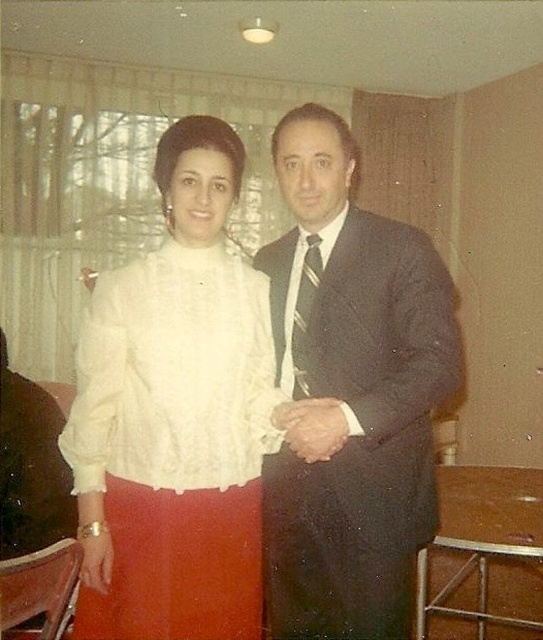
You are a photographer adjusting the lighting for a portrait. You notice the white lace blouse at center and the striped silk tie at center. Which item requires more light to ensure its intricate details are visible?

The white lace blouse at center requires more light because it is bigger than the striped silk tie at center, making its details harder to capture clearly without sufficient illumination.

You are a photographer setting up for a group photo. You have two subjects wearing the white lace blouse at center and the dark gray suit at center. You want to ensure both subjects are in focus. Which subject should you adjust the camera focus to prioritize first to ensure proper depth of field?

The white lace blouse at center is smaller than the dark gray suit at center. To ensure proper depth of field, prioritize focusing on the larger subject, the dark gray suit at center first, as it requires more focus coverage.